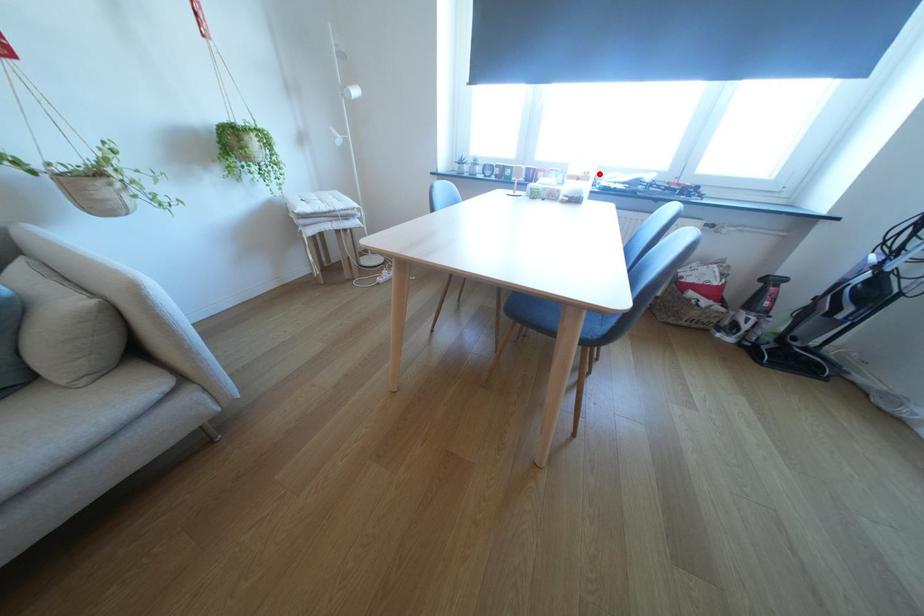
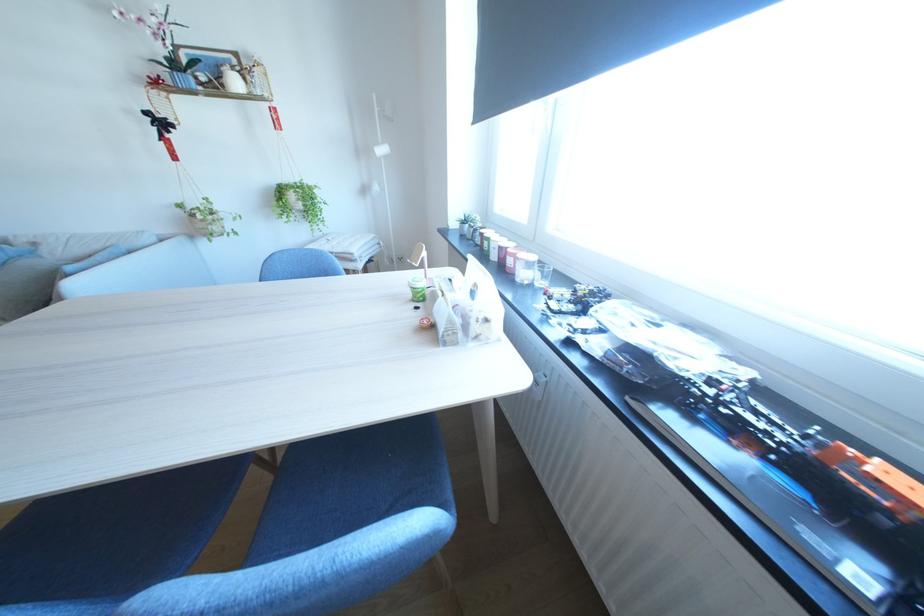
Locate, in the second image, the point that corresponds to the highlighted location in the first image.

(489, 288)